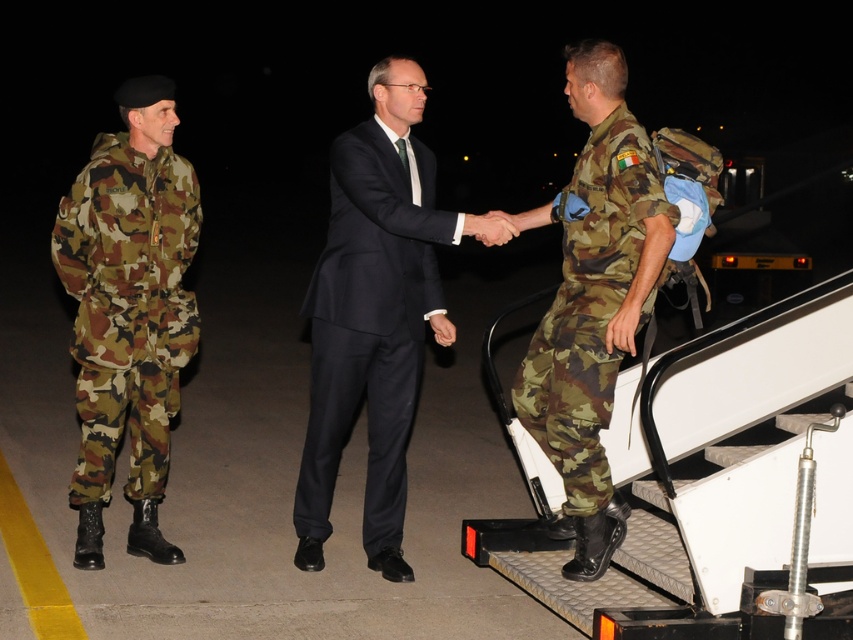
Question: Which object is the farthest from the camo fabric uniform at left?

Choices:
 (A) camo fabric uniform at right
 (B) dark blue suit at center

Answer: (A)

Question: Among these objects, which one is farthest from the camera?

Choices:
 (A) dark blue suit at center
 (B) camo fabric uniform at left

Answer: (B)

Question: Can you confirm if dark blue suit at center is thinner than camo fabric uniform at right?

Choices:
 (A) yes
 (B) no

Answer: (B)

Question: Can you confirm if dark blue suit at center is wider than camo fabric uniform at right?

Choices:
 (A) no
 (B) yes

Answer: (B)

Question: Is dark blue suit at center below camo fabric uniform at right?

Choices:
 (A) yes
 (B) no

Answer: (A)

Question: Based on their relative distances, which object is nearer to the dark blue suit at center?

Choices:
 (A) camo fabric uniform at left
 (B) camo fabric uniform at right

Answer: (B)